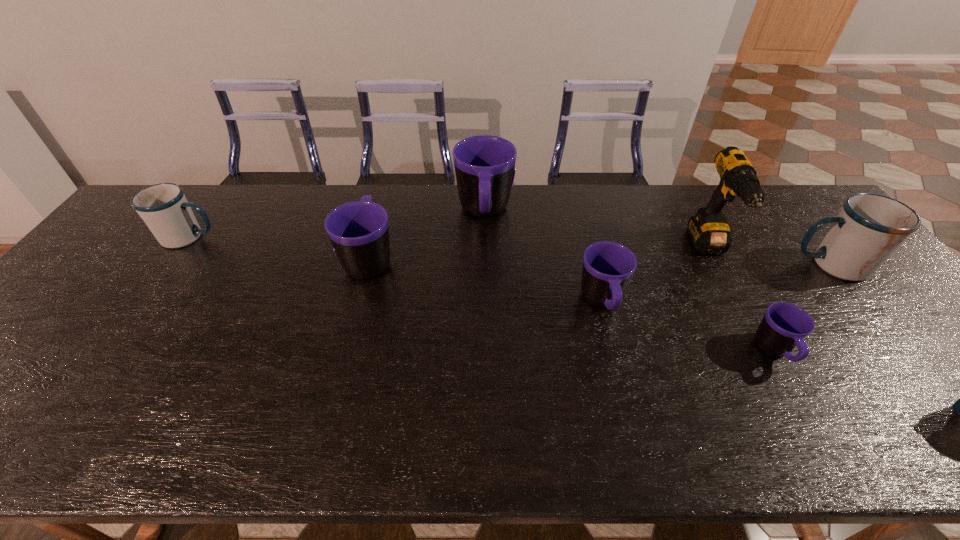
In the image, there is a desktop. Where is `vacant space at the near edge`? vacant space at the near edge is located at coordinates (128, 415).

In the image, there is a desktop. Find the location of `vacant area at the left edge`. vacant area at the left edge is located at coordinates (10, 395).

Where is `empty space between the left white mug and the fourth object from right to left`? This screenshot has height=540, width=960. empty space between the left white mug and the fourth object from right to left is located at coordinates (396, 270).

I want to click on unoccupied area between the second object from left to right and the black drill, so click(x=540, y=254).

Locate an element on the screen. unoccupied area between the rightmost black mug and the bigger white mug is located at coordinates (803, 308).

Locate an element on the screen. The height and width of the screenshot is (540, 960). free space between the third black mug from right to left and the fourth object from left to right is located at coordinates (543, 258).

Image resolution: width=960 pixels, height=540 pixels. Identify the location of vacant area that lies between the shortest mug and the fifth mug from right to left. (572, 305).

Identify which object is located as the third nearest to the rightmost black mug. Please provide its 2D coordinates. Your answer should be formatted as a tuple, i.e. [(x, y)], where the tuple contains the x and y coordinates of a point satisfying the conditions above.

[(608, 267)]

Identify which object is the third closest to the rightmost object. Please provide its 2D coordinates. Your answer should be formatted as a tuple, i.e. [(x, y)], where the tuple contains the x and y coordinates of a point satisfying the conditions above.

[(608, 267)]

At what (x,y) coordinates should I click in order to perform the action: click on mug that can be found as the third closest to the third black mug from left to right. Please return your answer as a coordinate pair (x, y). Looking at the image, I should click on (359, 232).